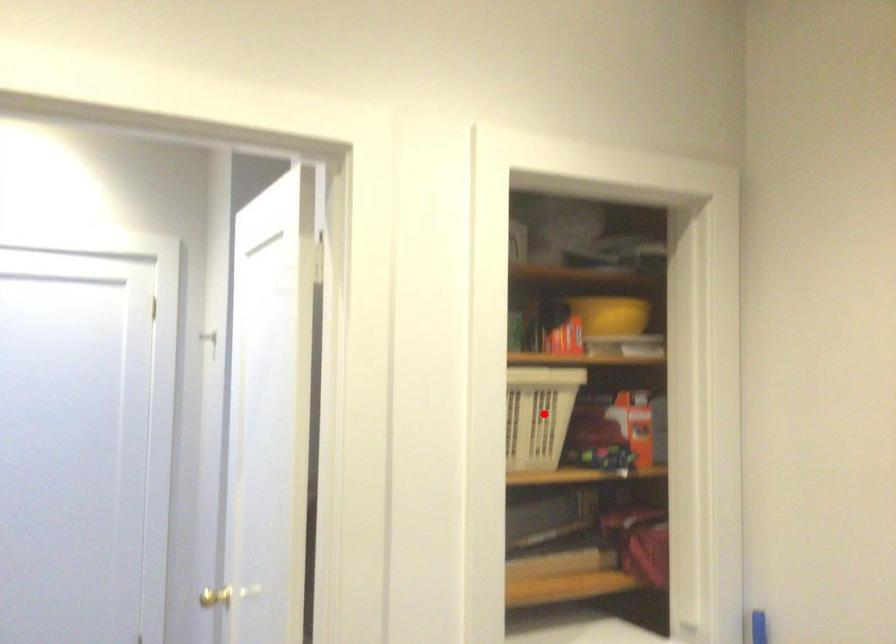
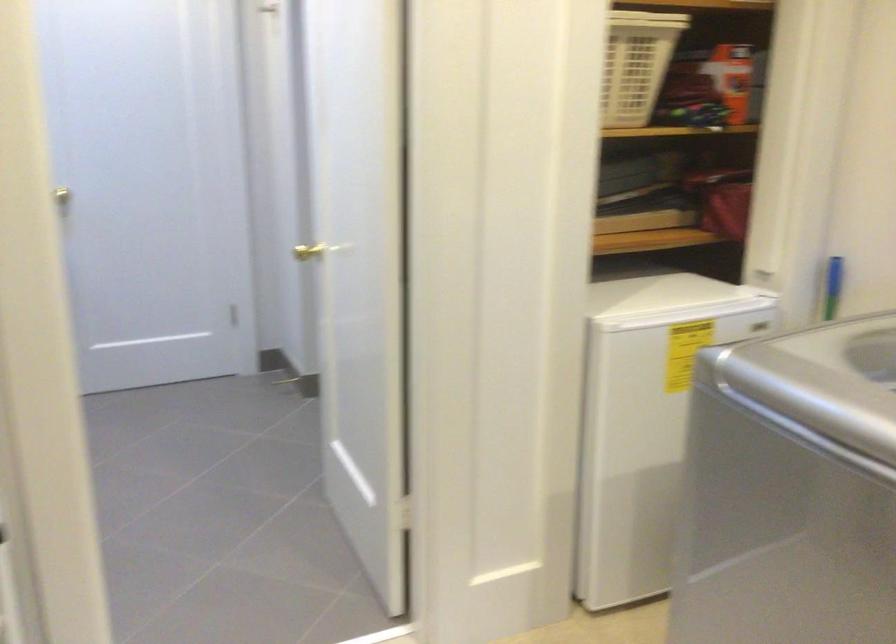
Locate, in the second image, the point that corresponds to the highlighted location in the first image.

(636, 64)